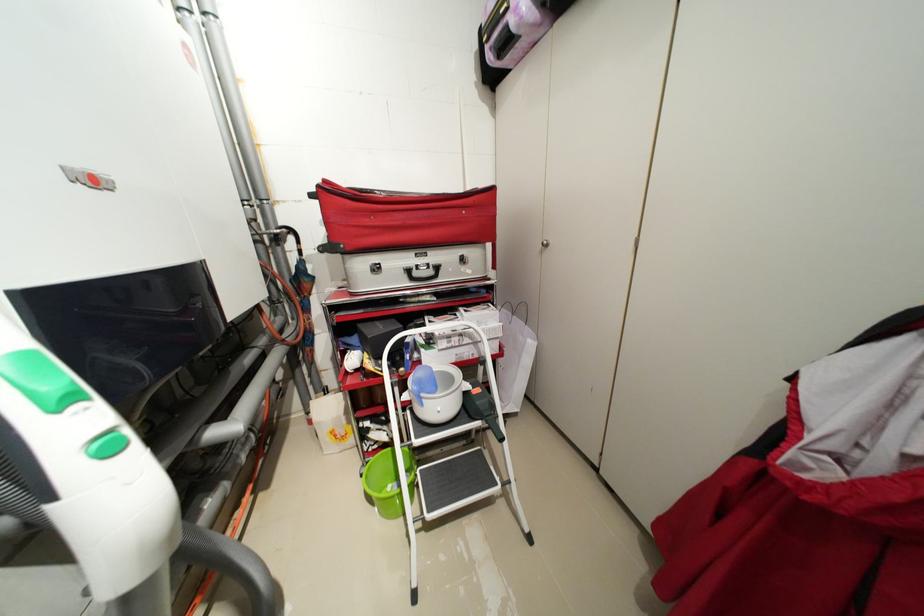
Where would you pull the silver suitcase handle? Please return your answer as a coordinate pair (x, y).

(421, 272)